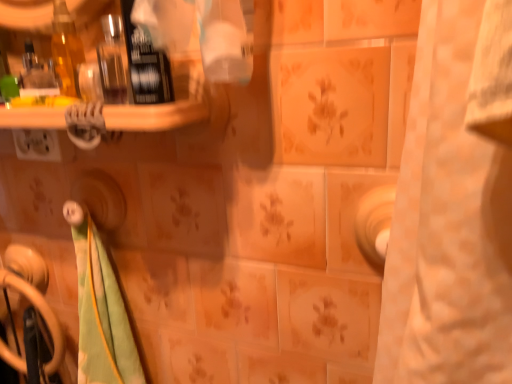
Question: Is point (5, 345) positioned closer to the camera than point (130, 125)?

Choices:
 (A) farther
 (B) closer

Answer: (A)

Question: Which is correct: black plastic door handle at lower left is inside white plastic toothbrushes at upper left, or outside of it?

Choices:
 (A) inside
 (B) outside

Answer: (B)

Question: Looking at the image, does black plastic door handle at lower left seem bigger or smaller compared to white plastic toothbrushes at upper left?

Choices:
 (A) small
 (B) big

Answer: (B)

Question: From a real-world perspective, is white plastic toothbrushes at upper left above or below black plastic door handle at lower left?

Choices:
 (A) above
 (B) below

Answer: (A)

Question: Considering the positions of white plastic toothbrushes at upper left and black plastic door handle at lower left in the image, is white plastic toothbrushes at upper left taller or shorter than black plastic door handle at lower left?

Choices:
 (A) tall
 (B) short

Answer: (B)

Question: From the image's perspective, is white plastic toothbrushes at upper left above or below black plastic door handle at lower left?

Choices:
 (A) below
 (B) above

Answer: (B)

Question: Is white plastic toothbrushes at upper left bigger or smaller than black plastic door handle at lower left?

Choices:
 (A) small
 (B) big

Answer: (A)